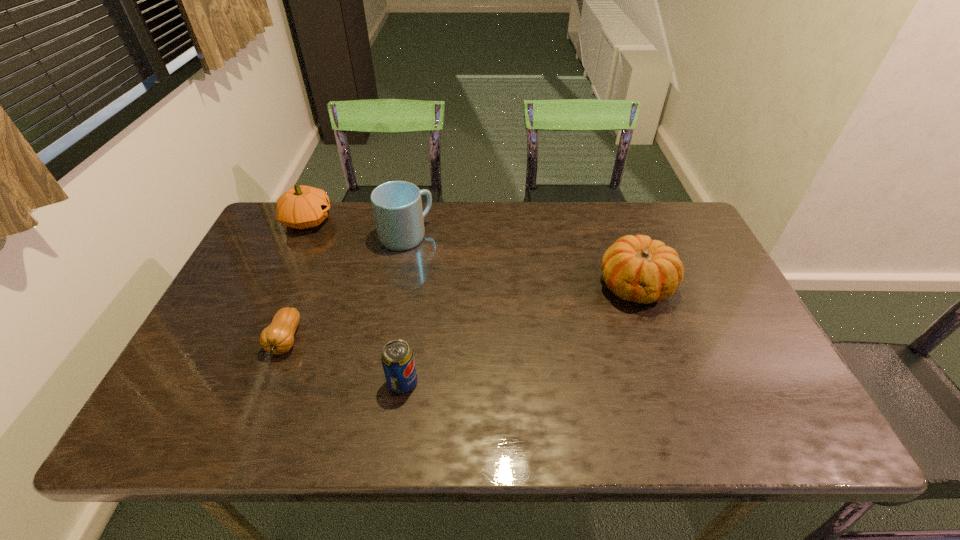
Image resolution: width=960 pixels, height=540 pixels. I want to click on free space between the mug and the shortest gourd, so click(346, 288).

Where is `free spot between the mug and the farthest gourd`? free spot between the mug and the farthest gourd is located at coordinates (357, 228).

I want to click on free space between the farthest gourd and the nearest object, so click(355, 301).

You are a GUI agent. You are given a task and a screenshot of the screen. Output one action in this format:
    pyautogui.click(x=<x>, y=<y>)
    Task: Click on the object that can be found as the fourth closest to the nearest object
    This screenshot has height=540, width=960.
    Given the screenshot: What is the action you would take?
    pyautogui.click(x=301, y=207)

Where is `object that stands as the second closest to the nearest gourd`? This screenshot has height=540, width=960. object that stands as the second closest to the nearest gourd is located at coordinates click(397, 206).

Find the location of `gourd that can be found as the second closest to the mug`. gourd that can be found as the second closest to the mug is located at coordinates (278, 338).

You are a GUI agent. You are given a task and a screenshot of the screen. Output one action in this format:
    pyautogui.click(x=<x>, y=<y>)
    Task: Click on the gourd that is the closest to the farthest gourd
    
    Given the screenshot: What is the action you would take?
    pyautogui.click(x=278, y=338)

Where is `vacant area that satisfies the following two spatial constraints: 1. on the stem side of the shortest object; 2. on the left side of the nearest object`? The width and height of the screenshot is (960, 540). vacant area that satisfies the following two spatial constraints: 1. on the stem side of the shortest object; 2. on the left side of the nearest object is located at coordinates (269, 382).

The height and width of the screenshot is (540, 960). Identify the location of vacant space that satisfies the following two spatial constraints: 1. on the side of the farthest gourd with the carved face; 2. on the back side of the third nearest object. (277, 286).

Find the location of a particular element. This screenshot has height=540, width=960. free space that satisfies the following two spatial constraints: 1. on the side of the farthest gourd with the carved face; 2. on the back side of the rightmost object is located at coordinates (277, 286).